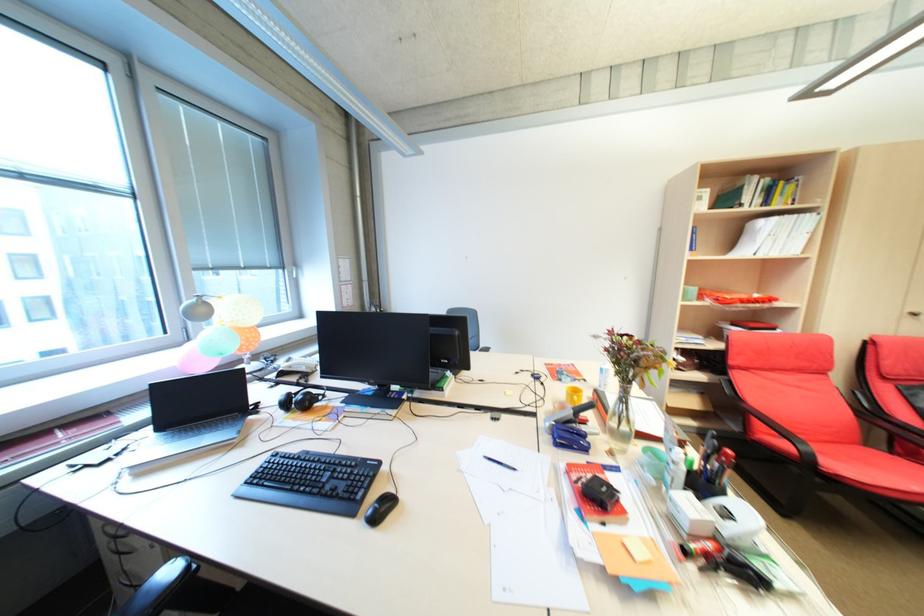
Where is `cabinet door handle`? This screenshot has height=616, width=924. cabinet door handle is located at coordinates (914, 313).